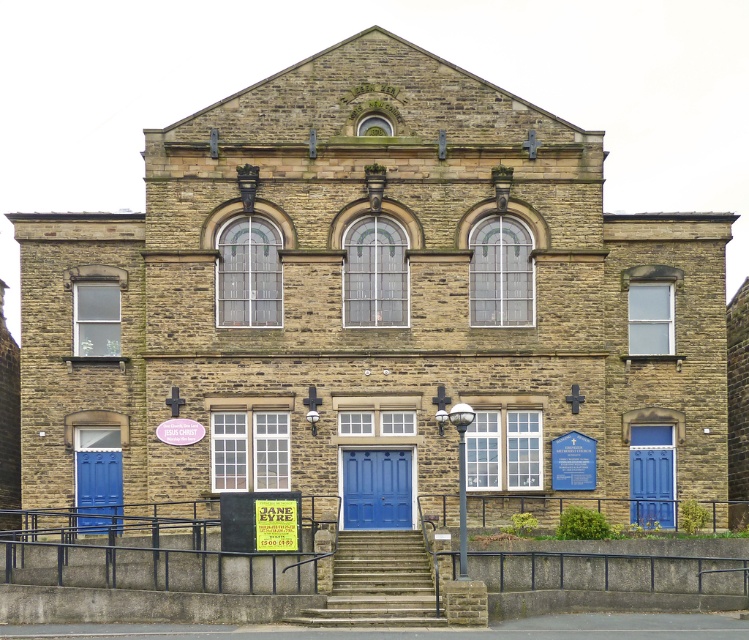
Question: Considering the real-world distances, which object is closest to the blue wooden door at right?

Choices:
 (A) blue matte door at center
 (B) stone steps at center

Answer: (A)

Question: Among these objects, which one is farthest from the camera?

Choices:
 (A) blue matte door at center
 (B) blue wooden door at right
 (C) blue wooden door at lower left

Answer: (B)

Question: Which object is positioned closest to the blue wooden door at lower left?

Choices:
 (A) blue matte door at center
 (B) blue wooden door at right
 (C) stone steps at center

Answer: (A)

Question: Can you confirm if blue wooden door at lower left is positioned below blue wooden door at right?

Choices:
 (A) yes
 (B) no

Answer: (A)

Question: Does stone steps at center lie in front of blue matte door at center?

Choices:
 (A) no
 (B) yes

Answer: (B)

Question: Does blue wooden door at lower left appear over blue wooden door at right?

Choices:
 (A) yes
 (B) no

Answer: (B)